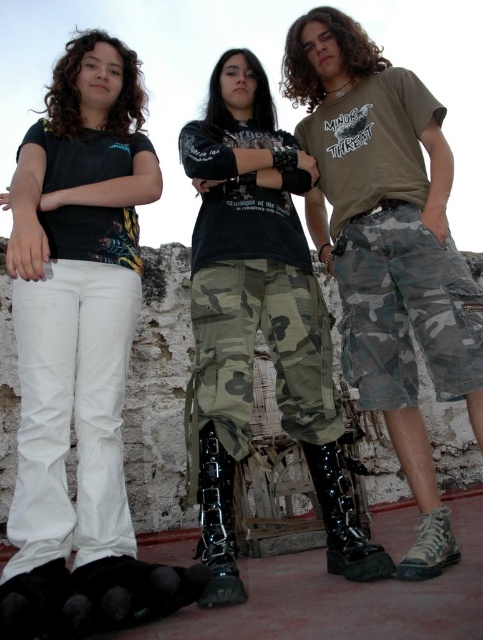
Can you confirm if camo shorts at center is thinner than glossy black boots at lower center?

No, camo shorts at center is not thinner than glossy black boots at lower center.

Can you confirm if camo shorts at center is bigger than glossy black boots at lower center?

Yes.

This screenshot has height=640, width=483. Identify the location of camo shorts at center. (387, 246).

Does point (316, 460) come closer to viewer compared to point (208, 556)?

No.

Which is below, glossy black boots at lower center or black leather boot at center?

Positioned lower is black leather boot at center.

At what (x,y) coordinates should I click in order to perform the action: click on glossy black boots at lower center. Please return your answer as a coordinate pair (x, y). Looking at the image, I should click on (343, 516).

Between point (413, 80) and point (420, 323), which one is positioned in front?

Point (420, 323) is in front.

Who is more forward, (438, 496) or (395, 291)?

Point (438, 496) is more forward.

The image size is (483, 640). I want to click on camo shorts at center, so click(x=387, y=246).